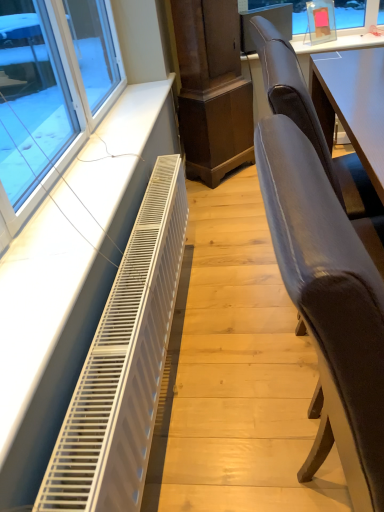
Question: Is white metallic radiator at lower left completely or partially outside of suede-like brown chair at right, the first chair from the back?

Choices:
 (A) no
 (B) yes

Answer: (B)

Question: Is white metallic radiator at lower left thinner than suede-like brown chair at right, positioned as the second chair in front-to-back order?

Choices:
 (A) yes
 (B) no

Answer: (A)

Question: From a real-world perspective, is white metallic radiator at lower left physically below suede-like brown chair at right, positioned as the second chair in front-to-back order?

Choices:
 (A) yes
 (B) no

Answer: (A)

Question: From the image's perspective, is white metallic radiator at lower left located above suede-like brown chair at right, positioned as the second chair in front-to-back order?

Choices:
 (A) yes
 (B) no

Answer: (B)

Question: Considering the relative sizes of white metallic radiator at lower left and suede-like brown chair at right, the first chair from the back, in the image provided, is white metallic radiator at lower left bigger than suede-like brown chair at right, the first chair from the back,?

Choices:
 (A) yes
 (B) no

Answer: (B)

Question: In the image, is velvet grey chair at right, positioned as the first chair in front-to-back order, positioned in front of or behind suede-like brown chair at right, the first chair from the back?

Choices:
 (A) front
 (B) behind

Answer: (A)

Question: Is velvet grey chair at right, placed as the second chair when sorted from back to front, bigger or smaller than suede-like brown chair at right, positioned as the second chair in front-to-back order?

Choices:
 (A) big
 (B) small

Answer: (B)

Question: Is point (307, 328) closer or farther from the camera than point (269, 96)?

Choices:
 (A) closer
 (B) farther

Answer: (A)

Question: Would you say velvet grey chair at right, positioned as the first chair in front-to-back order, is to the left or to the right of suede-like brown chair at right, the first chair from the back, in the picture?

Choices:
 (A) left
 (B) right

Answer: (A)

Question: In terms of width, does velvet grey chair at right, positioned as the first chair in front-to-back order, look wider or thinner when compared to white metallic radiator at lower left?

Choices:
 (A) wide
 (B) thin

Answer: (A)

Question: Considering their positions, is velvet grey chair at right, positioned as the first chair in front-to-back order, located in front of or behind white metallic radiator at lower left?

Choices:
 (A) front
 (B) behind

Answer: (A)

Question: Would you say velvet grey chair at right, positioned as the first chair in front-to-back order, is to the left or to the right of white metallic radiator at lower left in the picture?

Choices:
 (A) right
 (B) left

Answer: (A)

Question: From a real-world perspective, is velvet grey chair at right, positioned as the first chair in front-to-back order, above or below white metallic radiator at lower left?

Choices:
 (A) below
 (B) above

Answer: (B)

Question: In terms of width, does white metallic radiator at lower left look wider or thinner when compared to velvet grey chair at right, positioned as the first chair in front-to-back order?

Choices:
 (A) thin
 (B) wide

Answer: (A)

Question: From the image's perspective, is white metallic radiator at lower left positioned above or below velvet grey chair at right, placed as the second chair when sorted from back to front?

Choices:
 (A) above
 (B) below

Answer: (A)